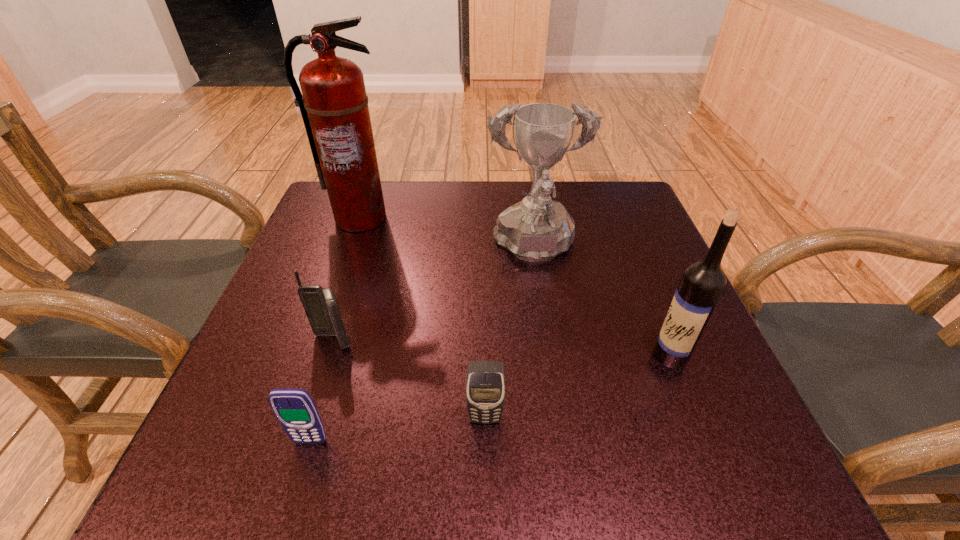
Identify the location of object that is positioned at the near left corner. The width and height of the screenshot is (960, 540). (294, 408).

In the image, there is a desktop. Where is `vacant area at the far edge`? vacant area at the far edge is located at coordinates (461, 208).

Where is `vacant space at the near edge of the desktop`? vacant space at the near edge of the desktop is located at coordinates (627, 457).

You are a GUI agent. You are given a task and a screenshot of the screen. Output one action in this format:
    pyautogui.click(x=<x>, y=<y>)
    Task: Click on the vacant space at the left edge
    
    Given the screenshot: What is the action you would take?
    pyautogui.click(x=356, y=239)

Where is `vacant area at the right edge`? vacant area at the right edge is located at coordinates (651, 299).

What are the coordinates of `vacant space at the far left corner` in the screenshot? It's located at (321, 198).

The height and width of the screenshot is (540, 960). What are the coordinates of `blank space at the far right corner of the desktop` in the screenshot? It's located at (580, 196).

You are a GUI agent. You are given a task and a screenshot of the screen. Output one action in this format:
    pyautogui.click(x=<x>, y=<y>)
    Task: Click on the vacant space at the near right corner
    
    Given the screenshot: What is the action you would take?
    pyautogui.click(x=692, y=483)

Find the location of a particular element. This screenshot has height=540, width=960. unoccupied area between the rightmost object and the tallest object is located at coordinates (516, 287).

The height and width of the screenshot is (540, 960). I want to click on free area in between the nearest object and the farthest cellular telephone, so click(x=322, y=392).